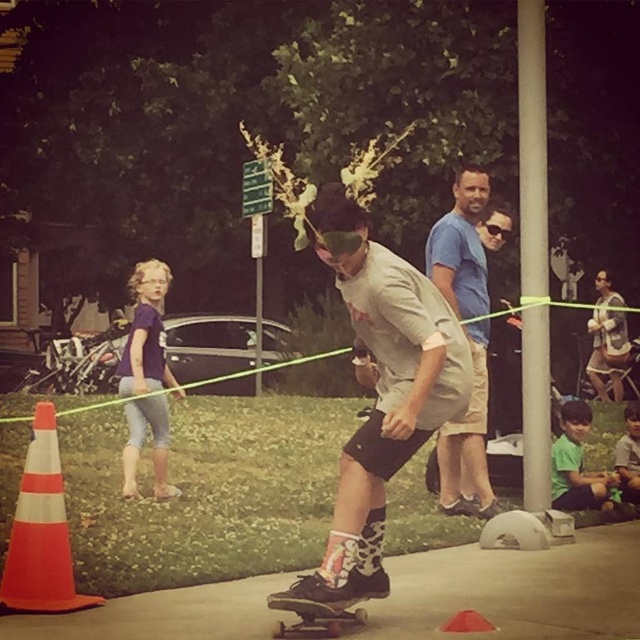
Question: Considering the real-world distances, which object is closest to the purple cotton shirt at center?

Choices:
 (A) green matte shirt at lower right
 (B) light blue cotton shirt at center
 (C) wooden skateboard at center

Answer: (B)

Question: Which point is closer to the camera?

Choices:
 (A) (346, 600)
 (B) (576, 442)
 (C) (476, 312)

Answer: (A)

Question: Which point is closer to the camera?

Choices:
 (A) wooden skateboard at center
 (B) light blue cotton shirt at center

Answer: (A)

Question: Does light blue cotton shirt at center appear under green matte shirt at lower right?

Choices:
 (A) yes
 (B) no

Answer: (B)

Question: Where is orange/white striped cone at left located in relation to wooden skateboard at center in the image?

Choices:
 (A) above
 (B) below

Answer: (A)

Question: Can you confirm if light blue cotton shirt at center is smaller than plaid flannel shirt at center?

Choices:
 (A) no
 (B) yes

Answer: (B)